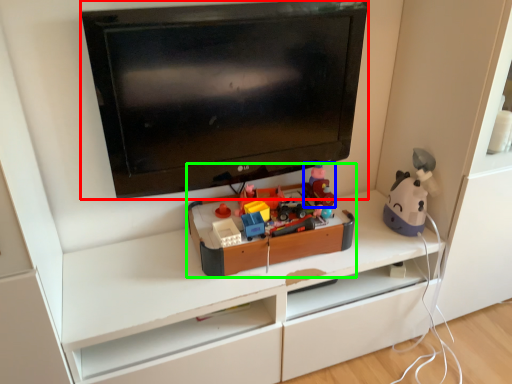
Question: Which object is positioned farthest from television (highlighted by a red box)? Select from toy (highlighted by a blue box) and toy (highlighted by a green box).

Choices:
 (A) toy
 (B) toy

Answer: (A)